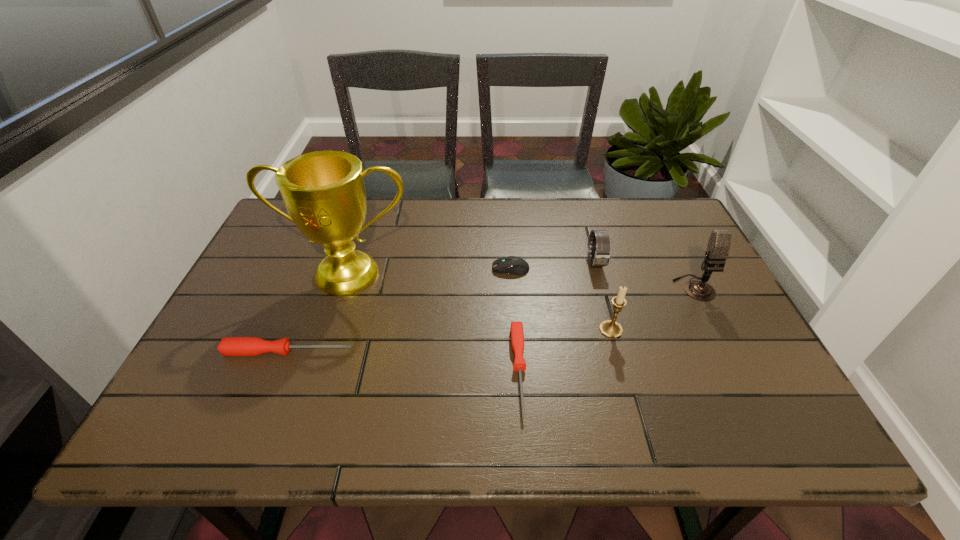
The screwdrivers are evenly distributed in the image. To maintain this, where would you place another screwdriver on the right? Please point to a free space. Please provide its 2D coordinates. Your answer should be formatted as a tuple, i.e. [(x, y)], where the tuple contains the x and y coordinates of a point satisfying the conditions above.

[(769, 392)]